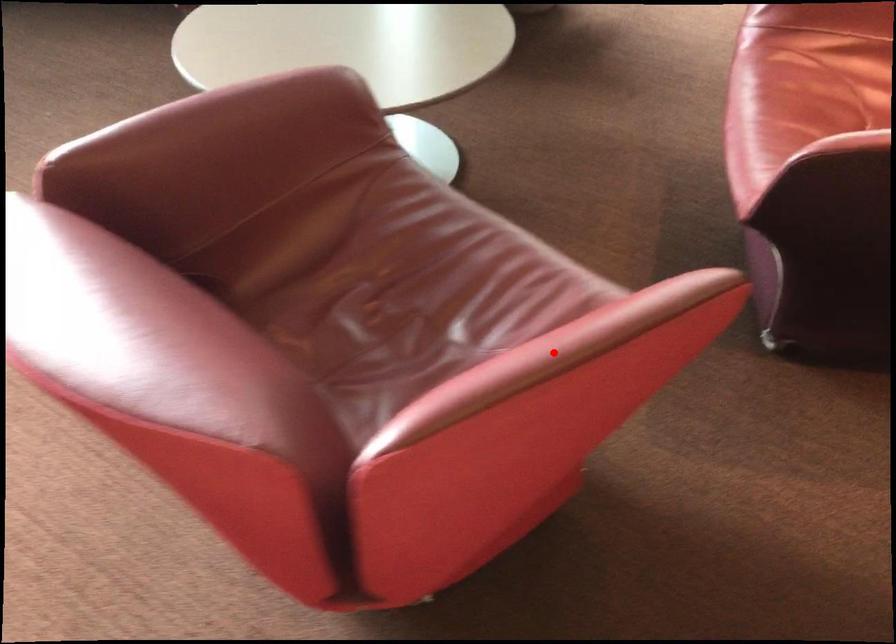
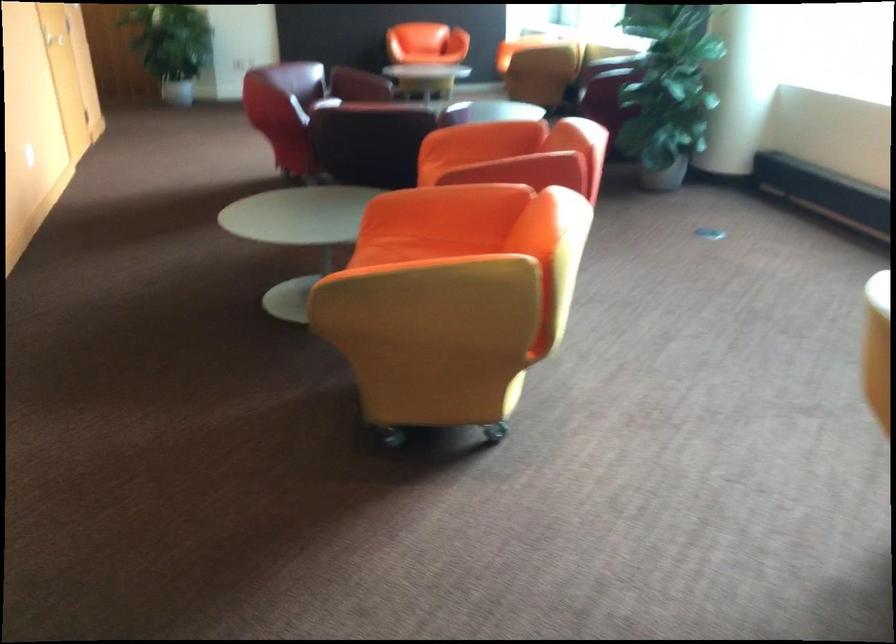
Question: I am providing you with two images of the same scene from different viewpoints. A red point is marked on the first image. At the location where the point appears in image 1, is it still visible in image 2?

Choices:
 (A) Yes
 (B) No

Answer: (B)